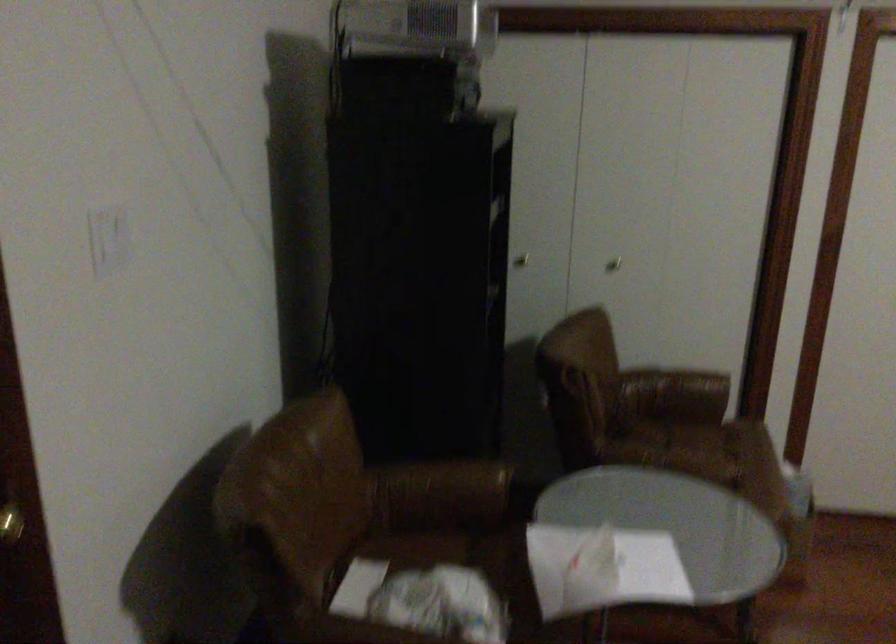
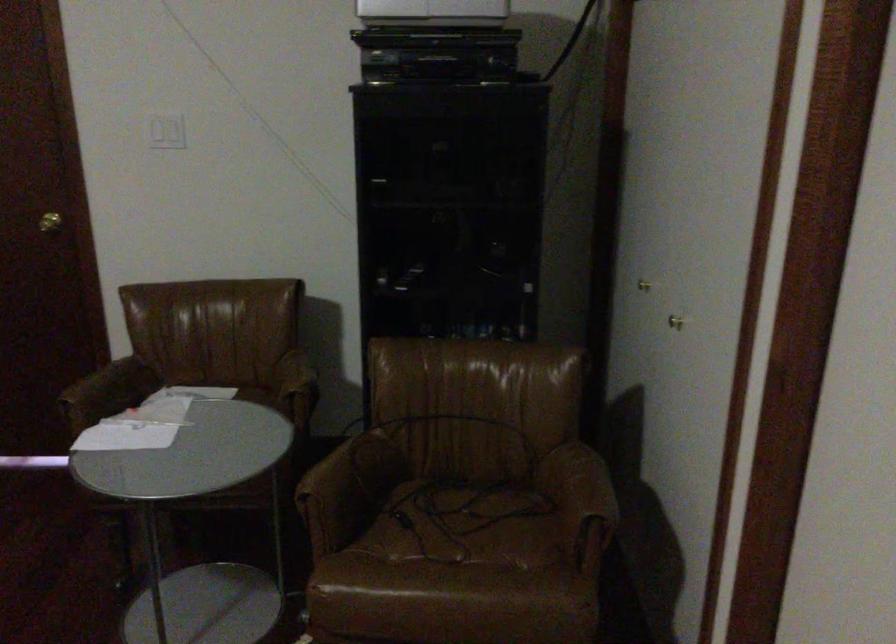
Locate, in the second image, the point that corresponds to point (724, 489) in the first image.

(312, 513)